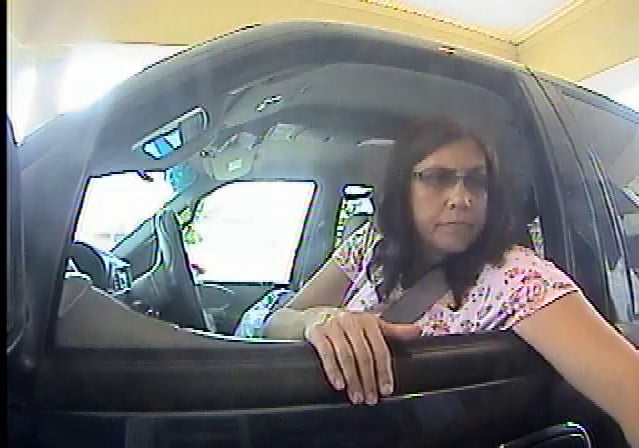
This screenshot has width=639, height=448. Find the location of `door`. door is located at coordinates (x=510, y=400).